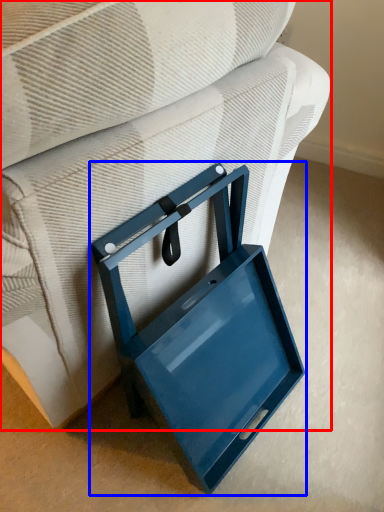
Question: Which object appears closest to the camera in this image, furniture (highlighted by a red box) or lunch box (highlighted by a blue box)?

Choices:
 (A) furniture
 (B) lunch box

Answer: (A)